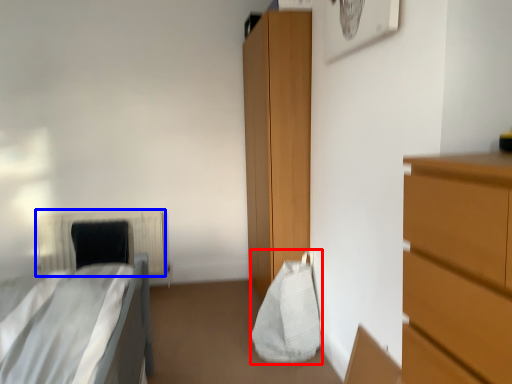
Question: Among these objects, which one is farthest to the camera, bag (highlighted by a red box) or radiator (highlighted by a blue box)?

Choices:
 (A) bag
 (B) radiator

Answer: (B)